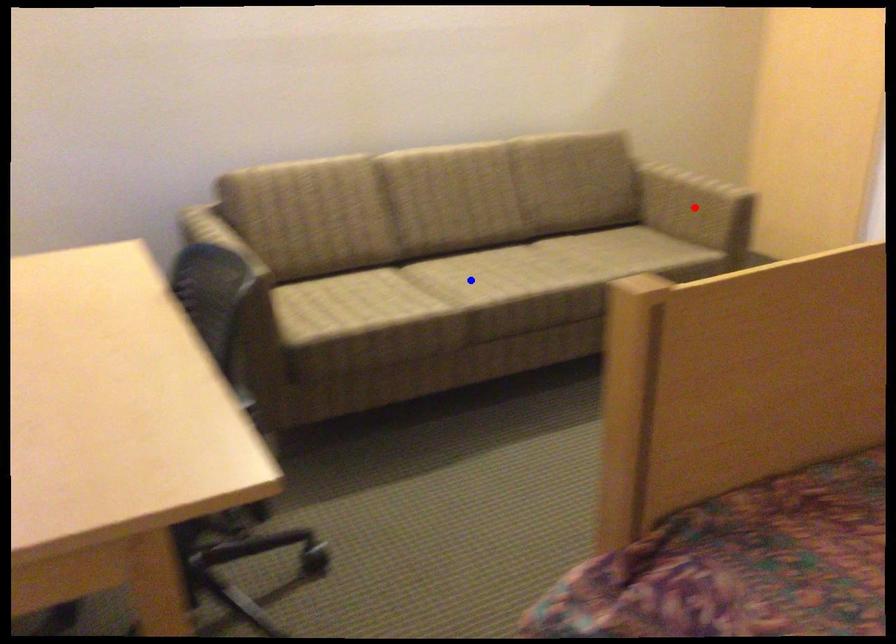
Question: Which of the two points in the image is closer to the camera?

Choices:
 (A) Blue point is closer.
 (B) Red point is closer.

Answer: (A)